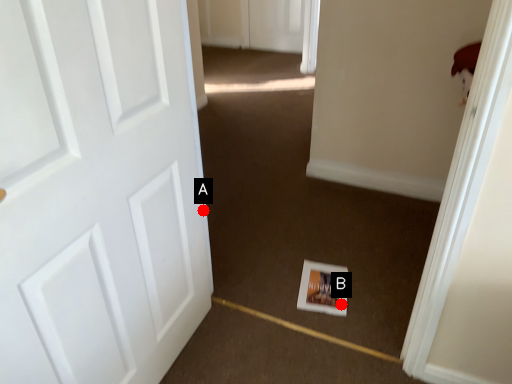
Question: Two points are circled on the image, labeled by A and B beside each circle. Which point appears closest to the camera in this image?

Choices:
 (A) A is closer
 (B) B is closer

Answer: (A)